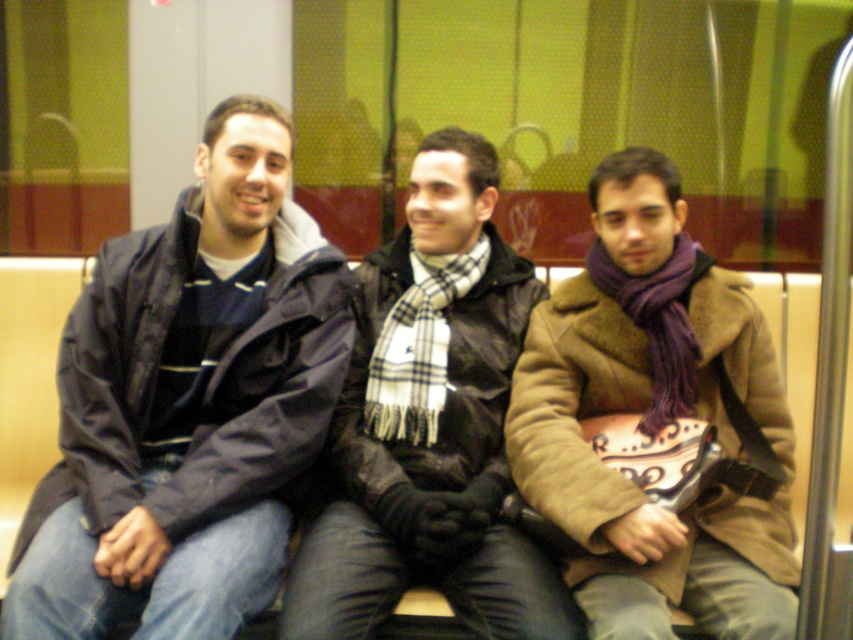
Question: Can you confirm if purple wool scarf at center is bigger than plaid scarf at center?

Choices:
 (A) yes
 (B) no

Answer: (B)

Question: In this image, where is matte black jacket at left located relative to plaid scarf at center?

Choices:
 (A) left
 (B) right

Answer: (A)

Question: Considering the real-world distances, which object is farthest from the matte black jacket at left?

Choices:
 (A) plaid scarf at center
 (B) purple wool scarf at center

Answer: (B)

Question: Does purple wool scarf at center appear under plaid scarf at center?

Choices:
 (A) no
 (B) yes

Answer: (B)

Question: Among these objects, which one is farthest from the camera?

Choices:
 (A) matte black jacket at left
 (B) plaid scarf at center

Answer: (B)

Question: Estimate the real-world distances between objects in this image. Which object is farther from the matte black jacket at left?

Choices:
 (A) purple wool scarf at center
 (B) plaid scarf at center

Answer: (A)